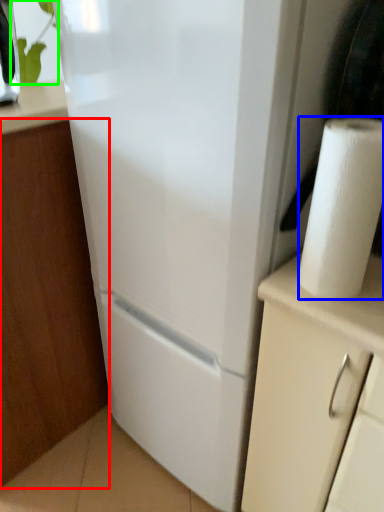
Question: Based on their relative distances, which object is farther from cabinetry (highlighted by a red box)? Choose from paper towel (highlighted by a blue box) and plant (highlighted by a green box).

Choices:
 (A) paper towel
 (B) plant

Answer: (B)